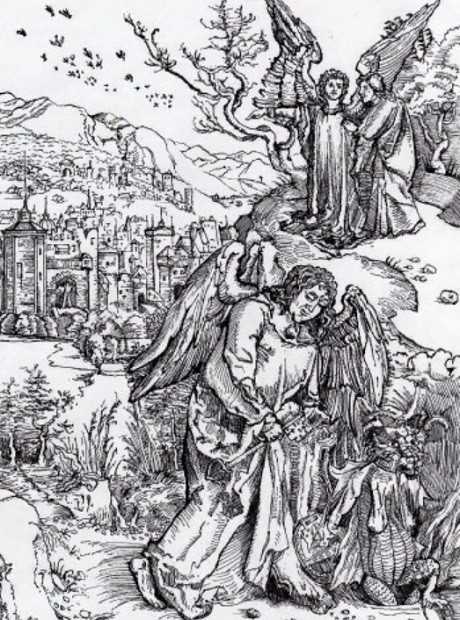
Where is `scales`? scales is located at coordinates (381, 556).